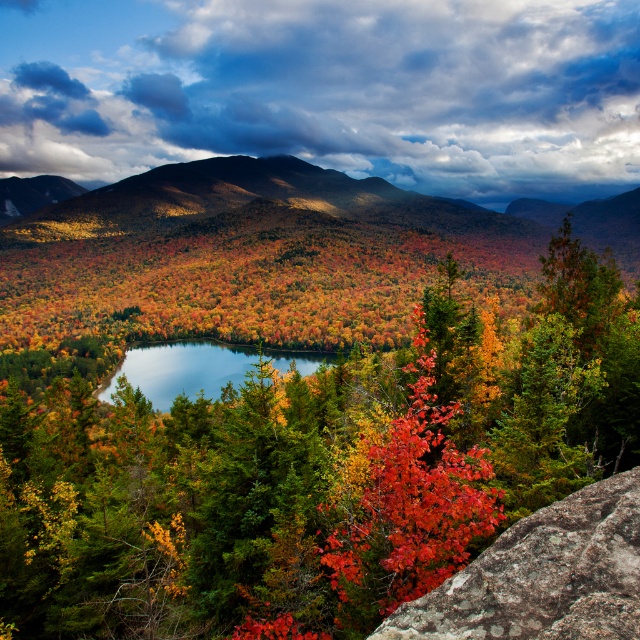
Which is above, vivid red leaves at center or blue glassy lake at center?

Positioned higher is vivid red leaves at center.

Is vivid red leaves at center smaller than blue glassy lake at center?

Indeed, vivid red leaves at center has a smaller size compared to blue glassy lake at center.

Locate an element on the screen. Image resolution: width=640 pixels, height=640 pixels. vivid red leaves at center is located at coordinates (404, 499).

You are a GUI agent. You are given a task and a screenshot of the screen. Output one action in this format:
    pyautogui.click(x=<x>, y=<y>)
    Task: Click on the vivid red leaves at center
    The width and height of the screenshot is (640, 640).
    Given the screenshot: What is the action you would take?
    pyautogui.click(x=404, y=499)

Is point (74, 451) closer to camera compared to point (131, 364)?

Yes, point (74, 451) is in front of point (131, 364).

Does autumn leaves at center have a greater height compared to blue glassy lake at center?

Indeed, autumn leaves at center has a greater height compared to blue glassy lake at center.

Locate an element on the screen. The image size is (640, 640). autumn leaves at center is located at coordinates (316, 468).

Is rusty rock at lower right to the left of blue glassy lake at center from the viewer's perspective?

No, rusty rock at lower right is not to the left of blue glassy lake at center.

Does rusty rock at lower right appear over blue glassy lake at center?

Correct, rusty rock at lower right is located above blue glassy lake at center.

Locate an element on the screen. This screenshot has width=640, height=640. rusty rock at lower right is located at coordinates (544, 576).

In order to click on rusty rock at lower right in this screenshot , I will do `click(544, 576)`.